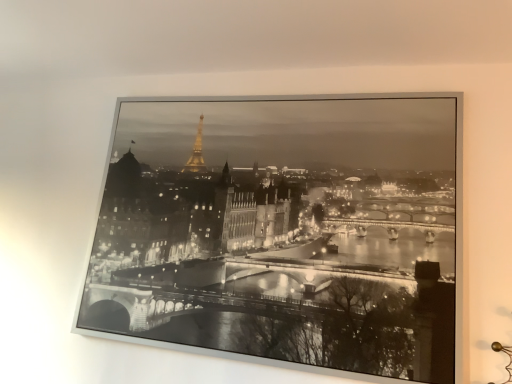
The image size is (512, 384). What do you see at coordinates (283, 232) in the screenshot? I see `metallic silver picture frame at upper center` at bounding box center [283, 232].

In order to face metallic silver picture frame at upper center, should I rotate leftwards or rightwards?

You should look right and rotate roughly 0.106 degrees.

This screenshot has width=512, height=384. I want to click on metallic silver picture frame at upper center, so click(x=283, y=232).

At what (x,y) coordinates should I click in order to perform the action: click on metallic silver picture frame at upper center. Please return your answer as a coordinate pair (x, y). The height and width of the screenshot is (384, 512). Looking at the image, I should click on [x=283, y=232].